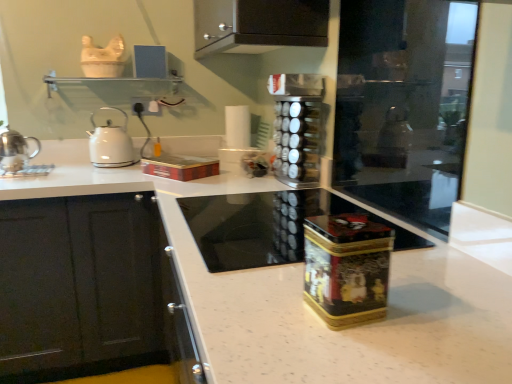
Where is `empty space that is ontop of white speckled granite at center`? empty space that is ontop of white speckled granite at center is located at coordinates (281, 233).